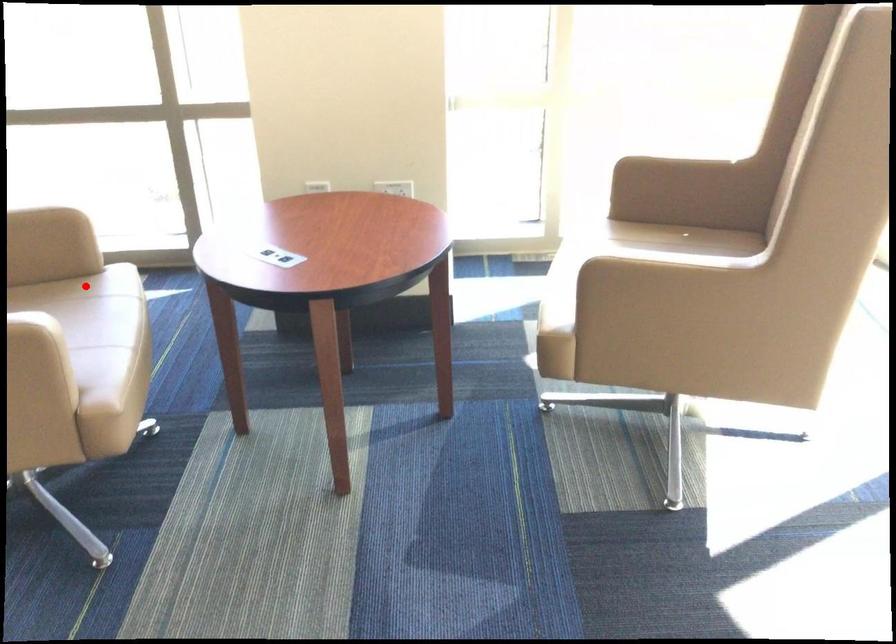
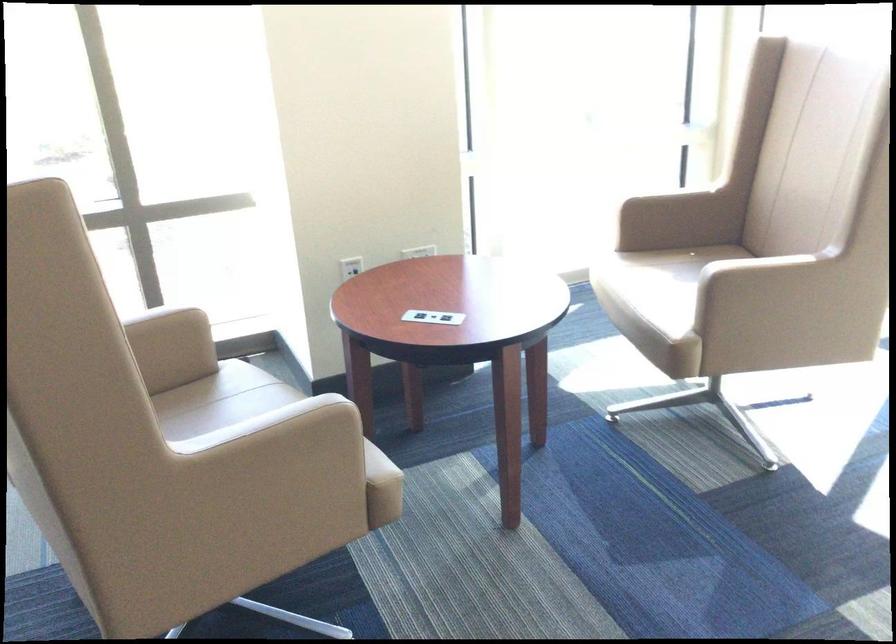
Find the pixel in the second image that matches the highlighted location in the first image.

(211, 389)